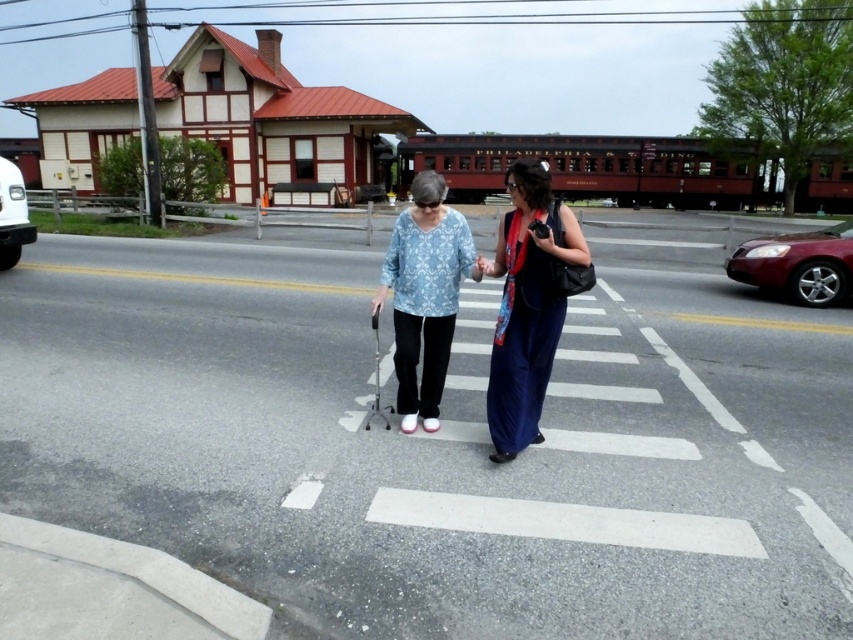
You are a photographer standing on the sidewalk. You want to take a photo of the blue silk dress at center and the white glossy van at left. Which object will appear larger in the photo?

The white glossy van at left will appear larger in the photo because it is bigger in size compared to the blue silk dress at center.